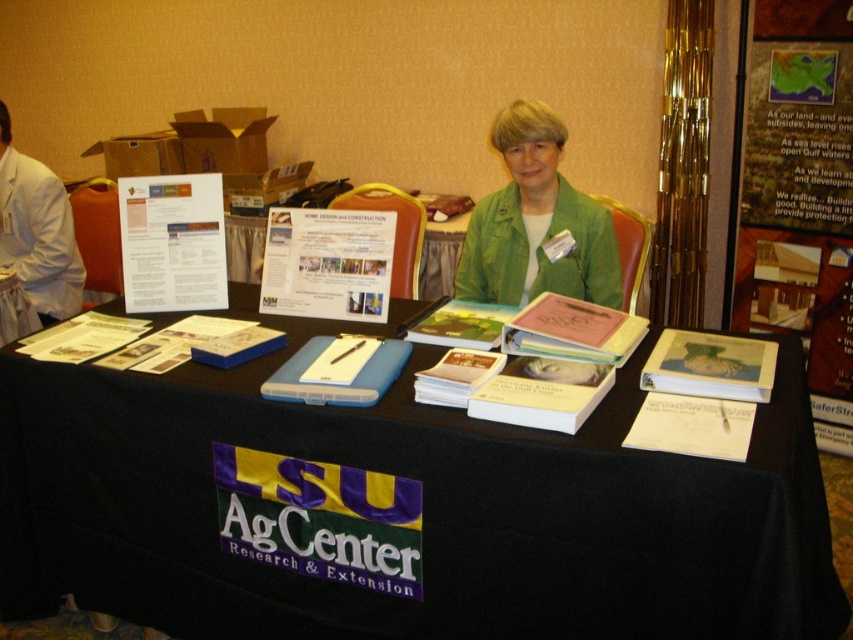
Is point (67, 330) behind point (442, 392)?

That is True.

This screenshot has width=853, height=640. I want to click on white paper at center, so click(x=84, y=337).

At what (x,y) coordinates should I click in order to perform the action: click on white paper at center. Please return your answer as a coordinate pair (x, y). The image size is (853, 640). Looking at the image, I should click on (84, 337).

Is the position of green fabric jacket at center less distant than that of white paper at center?

No, green fabric jacket at center is further to the viewer.

Which is in front, point (552, 154) or point (74, 317)?

Point (552, 154)

Where is `green fabric jacket at center`? This screenshot has width=853, height=640. green fabric jacket at center is located at coordinates (537, 221).

Which of these two, blue plastic folder at center or blue hardcover book at center, stands taller?

Standing taller between the two is blue plastic folder at center.

Which is more to the left, blue plastic folder at center or blue hardcover book at center?

From the viewer's perspective, blue hardcover book at center appears more on the left side.

Is point (288, 362) positioned behind point (245, 349)?

No.

Identify the location of blue plastic folder at center. This screenshot has width=853, height=640. (337, 385).